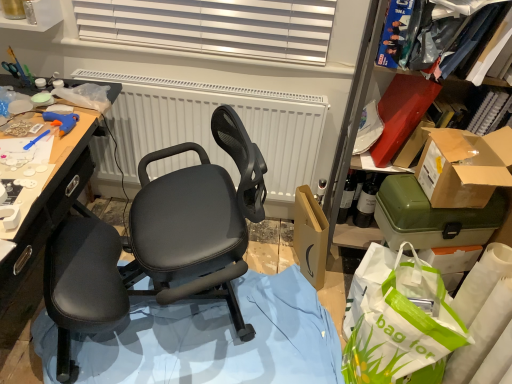
Question: Does green plastic container at right, marked as the first box in a bottom-to-top arrangement, turn towards white textured radiator at center?

Choices:
 (A) no
 (B) yes

Answer: (A)

Question: From the image's perspective, is green plastic container at right, marked as the first box in a bottom-to-top arrangement, below white textured radiator at center?

Choices:
 (A) yes
 (B) no

Answer: (A)

Question: Is green plastic container at right, marked as the first box in a bottom-to-top arrangement, further to camera compared to white textured radiator at center?

Choices:
 (A) no
 (B) yes

Answer: (A)

Question: Would you say green plastic container at right, marked as the first box in a bottom-to-top arrangement, contains white textured radiator at center?

Choices:
 (A) no
 (B) yes

Answer: (A)

Question: Considering the relative sizes of green plastic container at right, which ranks as the 2th box in top-to-bottom order, and white textured radiator at center in the image provided, is green plastic container at right, which ranks as the 2th box in top-to-bottom order, thinner than white textured radiator at center?

Choices:
 (A) yes
 (B) no

Answer: (B)

Question: Considering the positions of white textured radiator at center and green plastic container at right, marked as the first box in a bottom-to-top arrangement, in the image, is white textured radiator at center bigger or smaller than green plastic container at right, marked as the first box in a bottom-to-top arrangement,?

Choices:
 (A) big
 (B) small

Answer: (A)

Question: Considering the positions of point (144, 102) and point (415, 208), is point (144, 102) closer or farther from the camera than point (415, 208)?

Choices:
 (A) farther
 (B) closer

Answer: (A)

Question: From the image's perspective, relative to green plastic container at right, which ranks as the 2th box in top-to-bottom order, is white textured radiator at center above or below?

Choices:
 (A) above
 (B) below

Answer: (A)

Question: In the image, is white textured radiator at center positioned in front of or behind green plastic container at right, which ranks as the 2th box in top-to-bottom order?

Choices:
 (A) behind
 (B) front

Answer: (A)

Question: In terms of width, does green plastic container at right, which ranks as the 2th box in top-to-bottom order, look wider or thinner when compared to matte black office chair at center?

Choices:
 (A) thin
 (B) wide

Answer: (A)

Question: From their relative heights in the image, would you say green plastic container at right, marked as the first box in a bottom-to-top arrangement, is taller or shorter than matte black office chair at center?

Choices:
 (A) short
 (B) tall

Answer: (A)

Question: From the image's perspective, is green plastic container at right, marked as the first box in a bottom-to-top arrangement, above or below matte black office chair at center?

Choices:
 (A) above
 (B) below

Answer: (A)

Question: Based on their positions, is green plastic container at right, marked as the first box in a bottom-to-top arrangement, located to the left or right of matte black office chair at center?

Choices:
 (A) right
 (B) left

Answer: (A)

Question: In the image, is brown cardboard box at right, which appears as the first box when viewed from the top, on the left side or the right side of white textured radiator at center?

Choices:
 (A) left
 (B) right

Answer: (B)

Question: Is brown cardboard box at right, which appears as the first box when viewed from the top, in front of or behind white textured radiator at center in the image?

Choices:
 (A) behind
 (B) front

Answer: (B)